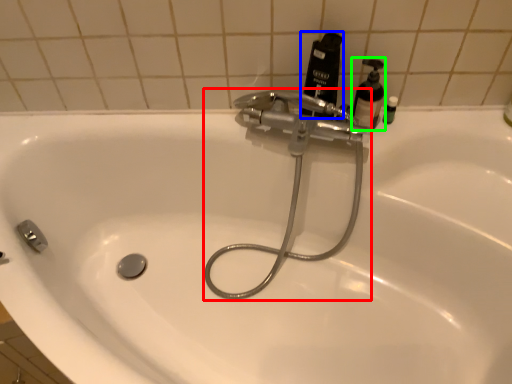
Question: Which is farther away from plumbing fixture (highlighted by a red box)? mouthwash (highlighted by a blue box) or soap dispenser (highlighted by a green box)?

Choices:
 (A) mouthwash
 (B) soap dispenser

Answer: (B)